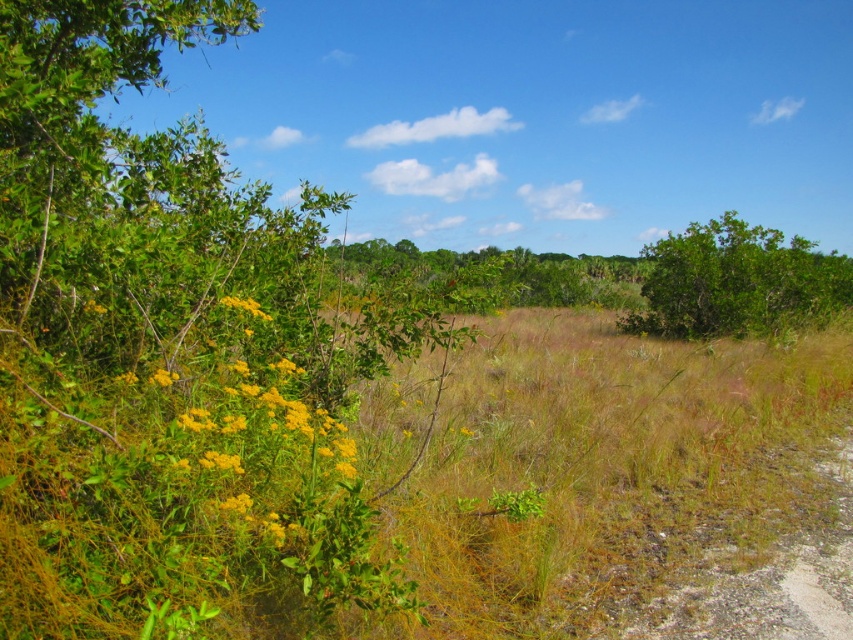
Question: Which object is farther from the camera taking this photo?

Choices:
 (A) yellow matte flowers at left
 (B) green leafy bush at upper right

Answer: (B)

Question: Does yellow matte flowers at left appear on the right side of green leafy bush at upper right?

Choices:
 (A) yes
 (B) no

Answer: (B)

Question: Where is yellow matte flowers at left located in relation to green leafy bush at upper right in the image?

Choices:
 (A) above
 (B) below

Answer: (B)

Question: Does yellow matte flowers at left appear under green leafy bush at upper right?

Choices:
 (A) yes
 (B) no

Answer: (A)

Question: Which point is farther from the camera taking this photo?

Choices:
 (A) (728, 250)
 (B) (267, 408)

Answer: (A)